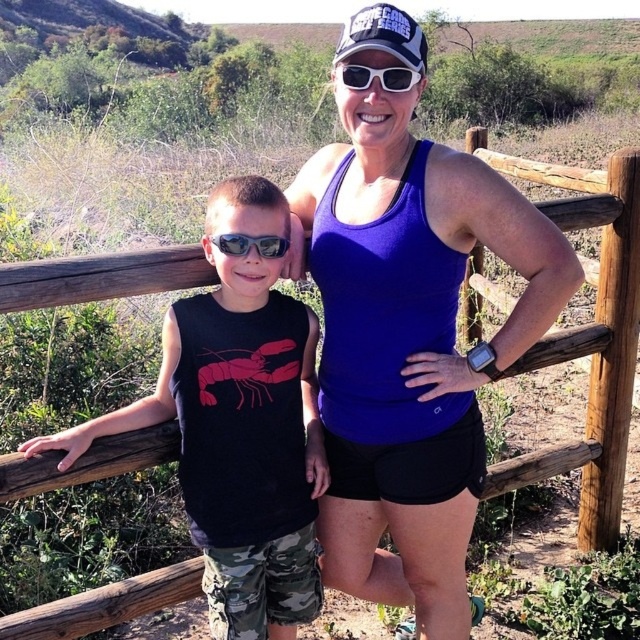
Looking at this image, you are a photographer setting up a shoot for a clothing catalog. You have two models wearing the purple fabric tank top at center and the black cotton shirt at left. The catalog requires that the smaller garment must be placed closer to the camera to ensure proper focus. Which model should you position closer to the camera?

The black cotton shirt at left is smaller in size than the purple fabric tank top at center, so you should position the model wearing the black cotton shirt at left closer to the camera to ensure proper focus.

You are a photographer trying to capture a clear shot of the black cotton shirt at left and the matte black goggles at left. Since both items are on the same person, which one is positioned lower on his body?

The black cotton shirt at left is below matte black goggles at left, so the shirt is positioned lower on his body than the goggles.